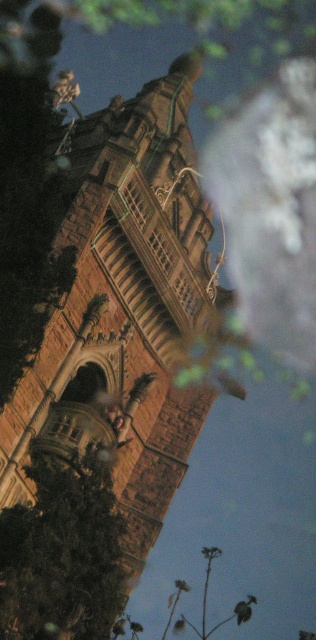
Question: Which of the following is the farthest from the observer?

Choices:
 (A) (6, 481)
 (B) (64, 515)

Answer: (A)

Question: Can you confirm if brown stone tower at center is positioned above green leafy tree at lower left?

Choices:
 (A) yes
 (B) no

Answer: (A)

Question: Can you confirm if brown stone tower at center is positioned to the left of green leafy tree at lower left?

Choices:
 (A) yes
 (B) no

Answer: (B)

Question: Considering the relative positions of brown stone tower at center and green leafy tree at lower left in the image provided, where is brown stone tower at center located with respect to green leafy tree at lower left?

Choices:
 (A) below
 (B) above

Answer: (B)